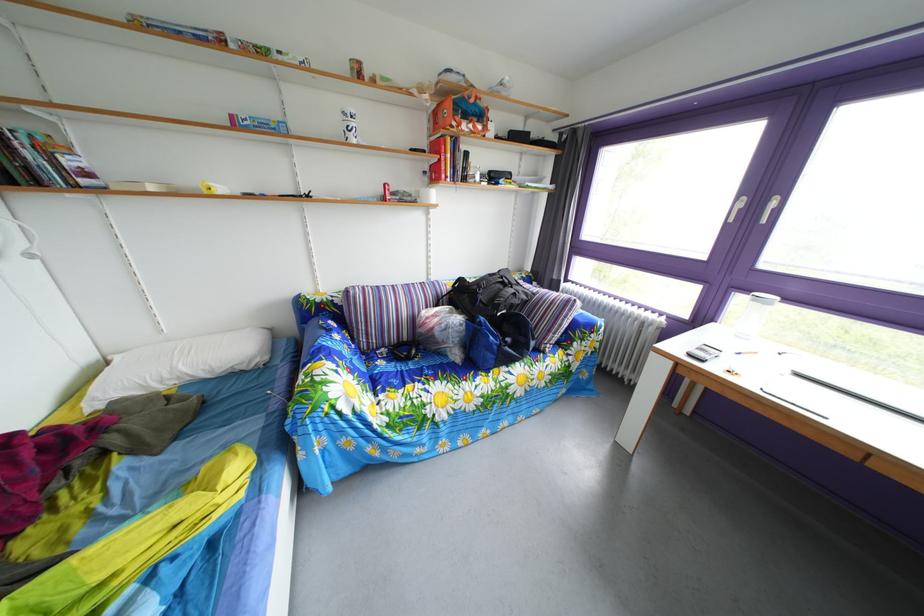
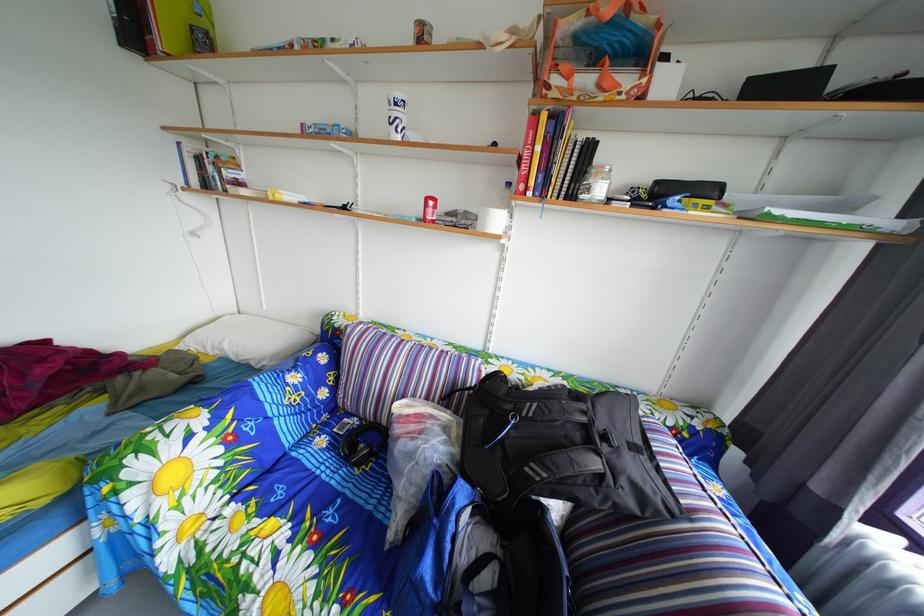
Where in the second image is the point corresponding to [407,386] from the first image?

(301, 493)